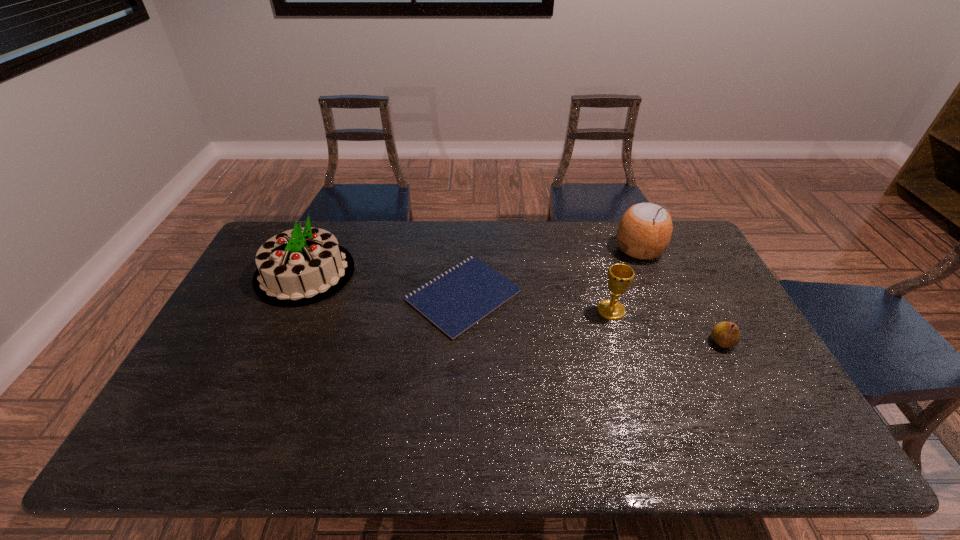
Find the location of a particular element. free space between the leftmost object and the second shortest object is located at coordinates (514, 307).

You are a GUI agent. You are given a task and a screenshot of the screen. Output one action in this format:
    pyautogui.click(x=<x>, y=<y>)
    Task: Click on the empty location between the birthday cake and the notepad
    The width and height of the screenshot is (960, 540).
    Given the screenshot: What is the action you would take?
    click(384, 284)

Select which object appears as the third closest to the coconut. Please provide its 2D coordinates. Your answer should be formatted as a tuple, i.e. [(x, y)], where the tuple contains the x and y coordinates of a point satisfying the conditions above.

[(456, 300)]

Identify which object is the third nearest to the coconut. Please provide its 2D coordinates. Your answer should be formatted as a tuple, i.e. [(x, y)], where the tuple contains the x and y coordinates of a point satisfying the conditions above.

[(456, 300)]

Locate an element on the screen. The width and height of the screenshot is (960, 540). vacant region that satisfies the following two spatial constraints: 1. on the back side of the leftmost object; 2. on the left side of the coconut is located at coordinates (316, 249).

This screenshot has height=540, width=960. What are the coordinates of `free space that satisfies the following two spatial constraints: 1. on the back side of the coconut; 2. on the right side of the birthday cake` in the screenshot? It's located at (316, 249).

At what (x,y) coordinates should I click in order to perform the action: click on free space that satisfies the following two spatial constraints: 1. on the front side of the second shortest object; 2. on the right side of the coconut. Please return your answer as a coordinate pair (x, y). Image resolution: width=960 pixels, height=540 pixels. Looking at the image, I should click on (679, 342).

Find the location of a particular element. The height and width of the screenshot is (540, 960). vacant point that satisfies the following two spatial constraints: 1. on the back side of the coconut; 2. on the left side of the notepad is located at coordinates (466, 249).

Locate an element on the screen. Image resolution: width=960 pixels, height=540 pixels. vacant space that satisfies the following two spatial constraints: 1. on the front side of the fourth tallest object; 2. on the left side of the notepad is located at coordinates (462, 342).

Where is `free space in the image that satisfies the following two spatial constraints: 1. on the back side of the birthday cake; 2. on the left side of the coconut`? free space in the image that satisfies the following two spatial constraints: 1. on the back side of the birthday cake; 2. on the left side of the coconut is located at coordinates (316, 249).